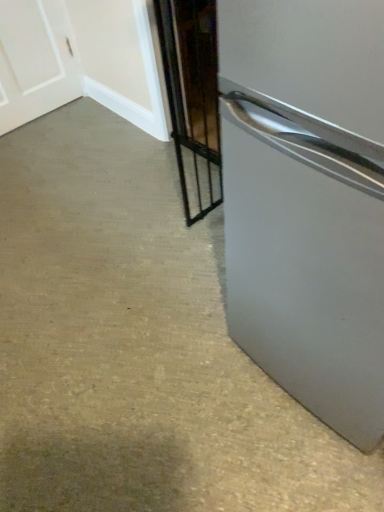
You are a GUI agent. You are given a task and a screenshot of the screen. Output one action in this format:
    pyautogui.click(x=<x>, y=<y>)
    Task: Click on the free space behind black metal screen door at center
    
    Given the screenshot: What is the action you would take?
    coord(195,199)